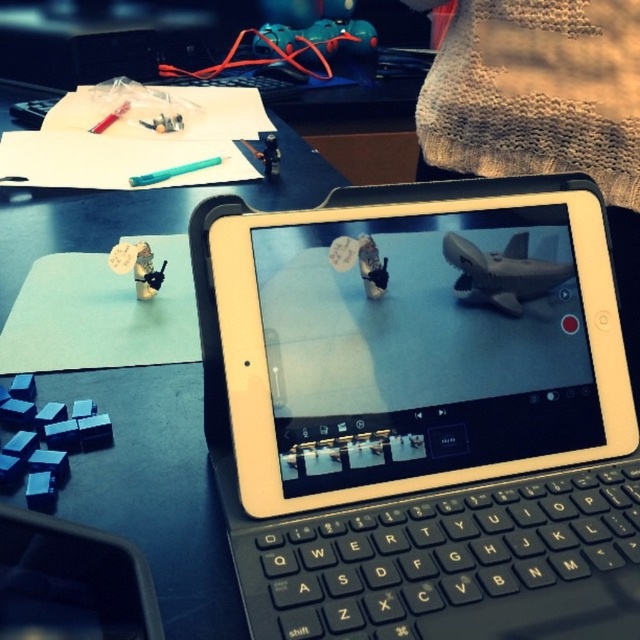
Question: Which of the following is the farthest from the observer?

Choices:
 (A) black plastic blocks at lower left
 (B) white paper at upper left

Answer: (A)

Question: Can you confirm if gray matte shark at center is positioned to the left of teal plastic controller at upper center?

Choices:
 (A) yes
 (B) no

Answer: (B)

Question: Does black plastic blocks at lower left appear on the right side of matte black drone at center?

Choices:
 (A) yes
 (B) no

Answer: (B)

Question: Is white matte tablet at center smaller than black plastic blocks at lower left?

Choices:
 (A) no
 (B) yes

Answer: (A)

Question: Which of the following is the farthest from the observer?

Choices:
 (A) (12, 456)
 (B) (276, 150)
 (C) (436, 300)

Answer: (B)

Question: Which point is closer to the camera?

Choices:
 (A) (273, 134)
 (B) (134, 234)
 (C) (141, 289)
 (D) (499, 257)

Answer: (D)